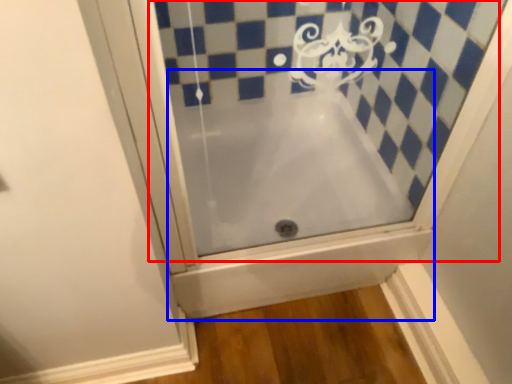
Question: Which object is further to the camera taking this photo, bath (highlighted by a red box) or bathtub (highlighted by a blue box)?

Choices:
 (A) bath
 (B) bathtub

Answer: (B)